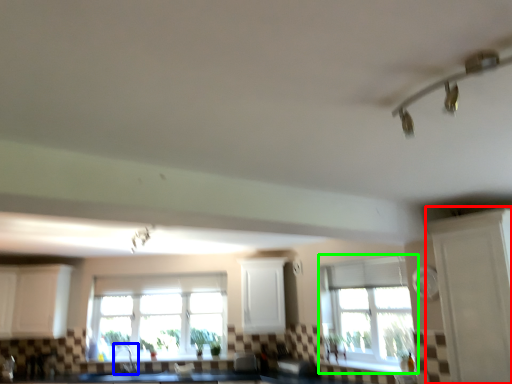
Question: Which object is positioned farthest from glass door (highlighted by a red box)? Select from faucet (highlighted by a blue box) and window (highlighted by a green box).

Choices:
 (A) faucet
 (B) window

Answer: (A)